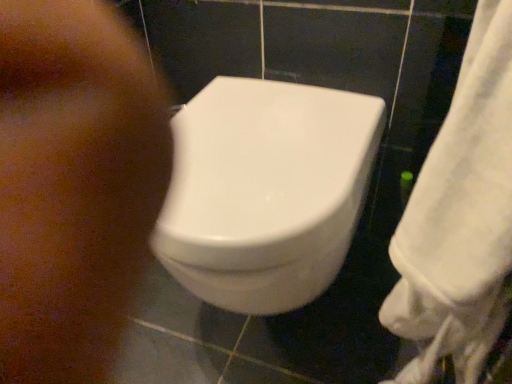
At what (x,y) coordinates should I click in order to perform the action: click on white glossy toilet at center. Please return your answer as a coordinate pair (x, y). This screenshot has width=512, height=384. Looking at the image, I should click on (266, 191).

Locate an element on the screen. brown matte skin at lower left is located at coordinates (73, 185).

This screenshot has height=384, width=512. What do you see at coordinates (460, 217) in the screenshot? I see `white fabric towel at right` at bounding box center [460, 217].

This screenshot has width=512, height=384. I want to click on white glossy toilet at center, so click(266, 191).

Can you tell me how much white glossy toilet at center and brown matte skin at lower left differ in facing direction?

There is a 1.58-degree angle between the facing directions of white glossy toilet at center and brown matte skin at lower left.

Which object is wider, white glossy toilet at center or brown matte skin at lower left?

With larger width is white glossy toilet at center.

Image resolution: width=512 pixels, height=384 pixels. What are the coordinates of `face above the white glossy toilet at center (from the image's perspective)` in the screenshot? It's located at (73, 185).

Based on the photo, from the image's perspective, does white glossy toilet at center appear higher than brown matte skin at lower left?

No, from the image's perspective, white glossy toilet at center is not on top of brown matte skin at lower left.

From a real-world perspective, is brown matte skin at lower left above or below white fabric towel at right?

Clearly, from a real-world perspective, brown matte skin at lower left is below white fabric towel at right.

Which of these two, brown matte skin at lower left or white fabric towel at right, stands shorter?

Standing shorter between the two is brown matte skin at lower left.

Would you say brown matte skin at lower left is a long distance from white fabric towel at right?

No.

The width and height of the screenshot is (512, 384). I want to click on face below the white fabric towel at right (from a real-world perspective), so click(73, 185).

Which is further, (451,298) or (216,184)?

Point (216,184)

Is white glossy toilet at center located within white fabric towel at right?

No, white glossy toilet at center is not inside white fabric towel at right.

Is white fabric towel at right far away from white glossy toilet at center?

white fabric towel at right is near white glossy toilet at center, not far away.

Which object is closer to the camera taking this photo, white fabric towel at right or white glossy toilet at center?

Positioned in front is white fabric towel at right.

Is white glossy toilet at center not within white fabric towel at right?

That's correct, white glossy toilet at center is outside of white fabric towel at right.

How different are the orientations of white glossy toilet at center and white fabric towel at right in degrees?

white glossy toilet at center and white fabric towel at right are facing 85.3 degrees away from each other.

Is white fabric towel at right at the back of white glossy toilet at center?

No.

From their relative heights in the image, would you say white glossy toilet at center is taller or shorter than white fabric towel at right?

white glossy toilet at center is shorter than white fabric towel at right.

From a real-world perspective, is brown matte skin at lower left physically located above or below white glossy toilet at center?

brown matte skin at lower left is situated lower than white glossy toilet at center in the real world.

From the image's perspective, which object appears higher, brown matte skin at lower left or white glossy toilet at center?

From the image's view, brown matte skin at lower left is above.

Can you confirm if brown matte skin at lower left is wider than white glossy toilet at center?

No, brown matte skin at lower left is not wider than white glossy toilet at center.

Does brown matte skin at lower left lie behind white glossy toilet at center?

Yes, brown matte skin at lower left is further from the viewer.

Can you confirm if white fabric towel at right is thinner than brown matte skin at lower left?

Indeed, white fabric towel at right has a lesser width compared to brown matte skin at lower left.

From the image's perspective, between white fabric towel at right and brown matte skin at lower left, who is located below?

white fabric towel at right, from the image's perspective.

Which is more to the right, white fabric towel at right or brown matte skin at lower left?

From the viewer's perspective, white fabric towel at right appears more on the right side.

Between point (392, 317) and point (72, 21), which one is positioned in front?

The point (392, 317) is closer.

At what (x,y) coordinates should I click in order to perform the action: click on toilet on the right of brown matte skin at lower left. Please return your answer as a coordinate pair (x, y). The image size is (512, 384). Looking at the image, I should click on (266, 191).

The width and height of the screenshot is (512, 384). I want to click on towel that is in front of the brown matte skin at lower left, so click(x=460, y=217).

Based on their spatial positions, is white glossy toilet at center or white fabric towel at right further from brown matte skin at lower left?

The object further to brown matte skin at lower left is white fabric towel at right.

Looking at the image, which one is located further to white fabric towel at right, white glossy toilet at center or brown matte skin at lower left?

Among the two, brown matte skin at lower left is located further to white fabric towel at right.

Which object lies further to the anchor point white glossy toilet at center, white fabric towel at right or brown matte skin at lower left?

white fabric towel at right.

Estimate the real-world distances between objects in this image. Which object is closer to brown matte skin at lower left, white fabric towel at right or white glossy toilet at center?

white glossy toilet at center is positioned closer to the anchor brown matte skin at lower left.

Estimate the real-world distances between objects in this image. Which object is further from white glossy toilet at center, brown matte skin at lower left or white fabric towel at right?

white fabric towel at right is positioned further to the anchor white glossy toilet at center.

From the image, which object appears to be nearer to white fabric towel at right, brown matte skin at lower left or white glossy toilet at center?

white glossy toilet at center.

Where is `toilet between brown matte skin at lower left and white fabric towel at right from left to right`? Image resolution: width=512 pixels, height=384 pixels. toilet between brown matte skin at lower left and white fabric towel at right from left to right is located at coordinates (266, 191).